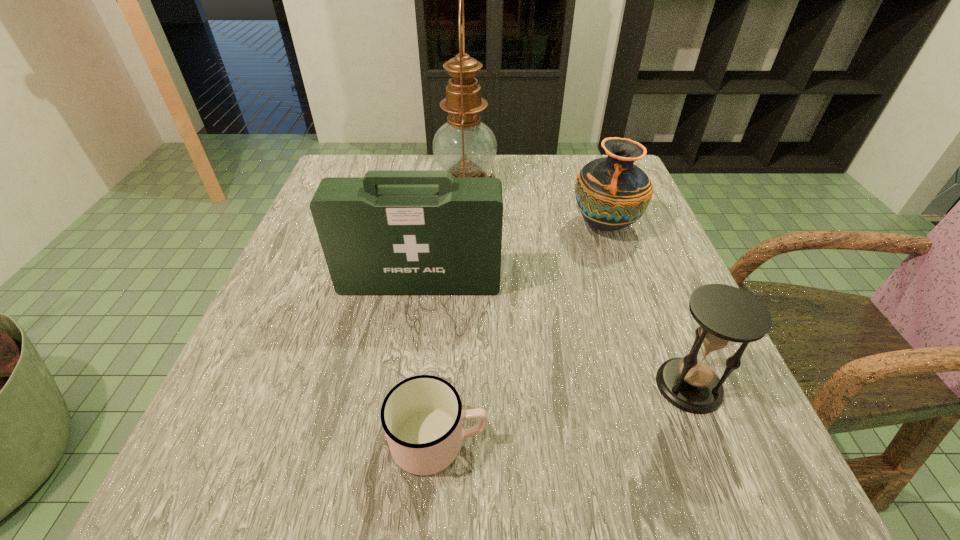
This screenshot has height=540, width=960. I want to click on oil lamp, so click(466, 147).

This screenshot has width=960, height=540. Find the location of `the first-aid kit`. the first-aid kit is located at coordinates (392, 232).

At what (x,y) coordinates should I click in order to perform the action: click on the third farthest object. Please return your answer as a coordinate pair (x, y). Looking at the image, I should click on (392, 232).

The height and width of the screenshot is (540, 960). In order to click on pottery in this screenshot , I will do `click(612, 193)`.

What are the coordinates of `hourglass` in the screenshot? It's located at (726, 315).

In order to click on mug in this screenshot , I will do `click(422, 416)`.

Where is `free spot located 0.270m on the right of the tallest object`? This screenshot has height=540, width=960. free spot located 0.270m on the right of the tallest object is located at coordinates (608, 186).

This screenshot has width=960, height=540. Identify the location of vacant area situated on the front-facing side of the fourth shortest object. (413, 334).

The height and width of the screenshot is (540, 960). I want to click on vacant space located 0.150m on the left of the pottery, so click(500, 226).

Identify the location of free region located on the left of the hourglass. The height and width of the screenshot is (540, 960). (584, 386).